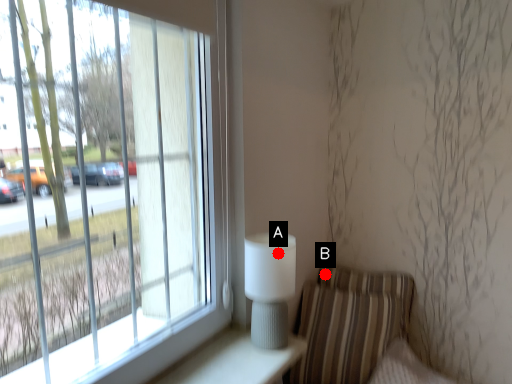
Question: Two points are circled on the image, labeled by A and B beside each circle. Among these points, which one is farthest from the camera?

Choices:
 (A) A is further
 (B) B is further

Answer: (B)